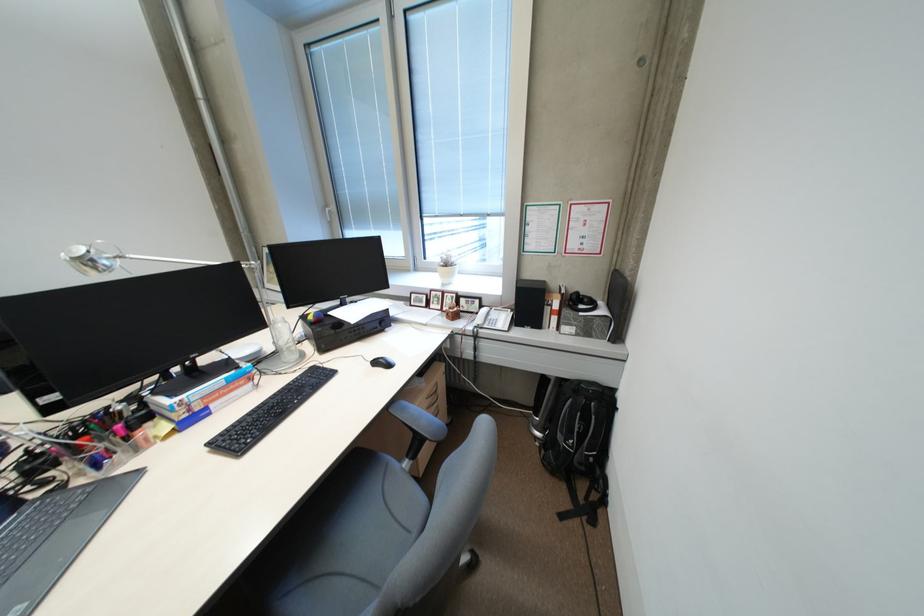
Locate an element on the screen. The image size is (924, 616). grey chair armrest is located at coordinates (407, 415).